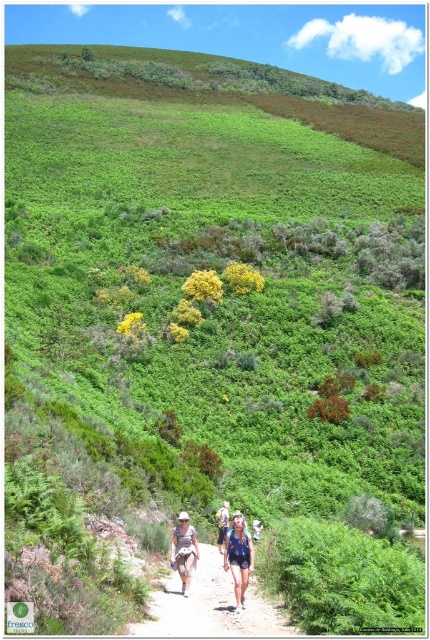
Can you confirm if brown dirt path at center is bigger than camouflage fabric shorts at center?

Correct, brown dirt path at center is larger in size than camouflage fabric shorts at center.

Is brown dirt path at center thinner than camouflage fabric shorts at center?

No.

Locate an element on the screen. Image resolution: width=430 pixels, height=640 pixels. brown dirt path at center is located at coordinates (208, 605).

Which is below, camouflage fabric shorts at center or blue denim shorts at center?

Positioned lower is blue denim shorts at center.

Who is more distant from viewer, (192, 556) or (224, 532)?

The point (224, 532) is behind.

Is point (193, 528) closer to viewer compared to point (218, 522)?

That is False.

The height and width of the screenshot is (640, 430). I want to click on camouflage fabric shorts at center, so click(184, 550).

Does brown dirt path at center have a larger size compared to denim shorts at center?

No, brown dirt path at center is not bigger than denim shorts at center.

Is brown dirt path at center in front of denim shorts at center?

Yes, it is.

Find the location of `brown dirt path at center`. brown dirt path at center is located at coordinates pos(208,605).